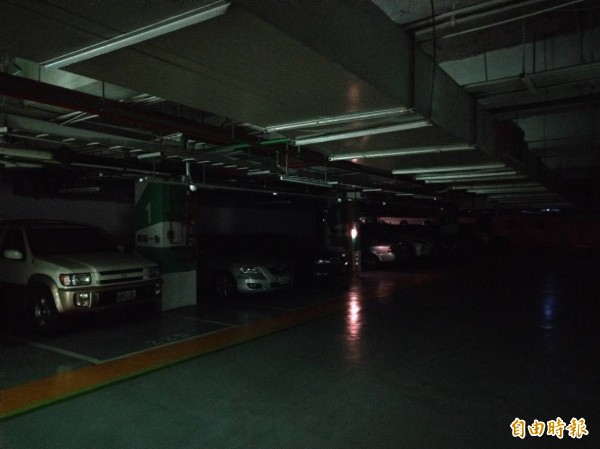
Where is `grey concrete floor`? This screenshot has width=600, height=449. grey concrete floor is located at coordinates (335, 393).